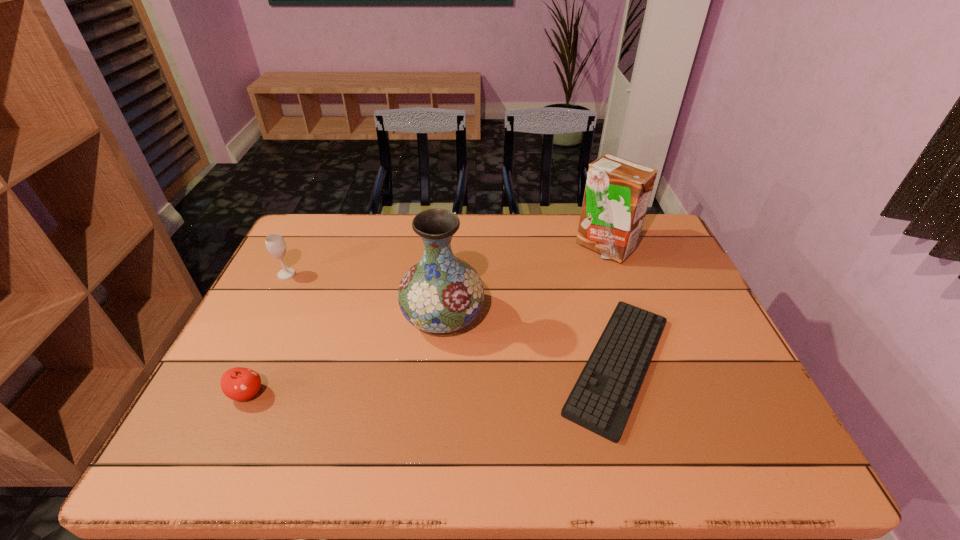
The image size is (960, 540). Identify the location of vacant space situated on the left of the computer keyboard. (390, 364).

The height and width of the screenshot is (540, 960). What are the coordinates of `object that is at the far edge` in the screenshot? It's located at (617, 193).

The width and height of the screenshot is (960, 540). Find the location of `object located in the near edge section of the desktop`. object located in the near edge section of the desktop is located at coordinates (601, 400).

Locate an element on the screen. wineglass that is at the left edge is located at coordinates (275, 243).

At what (x,y) coordinates should I click in order to perform the action: click on apple present at the left edge. Please return your answer as a coordinate pair (x, y). Looking at the image, I should click on click(239, 384).

At what (x,y) coordinates should I click in order to perform the action: click on carton positioned at the right edge. Please return your answer as a coordinate pair (x, y). Image resolution: width=960 pixels, height=540 pixels. Looking at the image, I should click on (617, 193).

You are a GUI agent. You are given a task and a screenshot of the screen. Output one action in this format:
    pyautogui.click(x=<x>, y=<y>)
    Task: Click on the computer keyboard positioned at the right edge
    The width and height of the screenshot is (960, 540).
    Given the screenshot: What is the action you would take?
    pyautogui.click(x=601, y=400)

At what (x,y) coordinates should I click in order to perform the action: click on object at the far right corner. Please return your answer as a coordinate pair (x, y). Looking at the image, I should click on (617, 193).

I want to click on object located in the near right corner section of the desktop, so click(x=601, y=400).

Where is `free space at the far edge of the desktop`? free space at the far edge of the desktop is located at coordinates (389, 222).